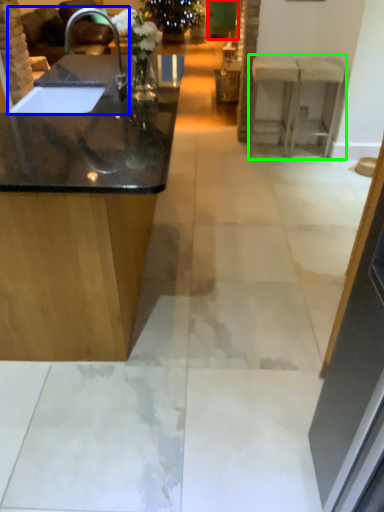
Question: Considering the real-world distances, which object is closest to glass door (highlighted by a red box)? sink (highlighted by a blue box) or counter (highlighted by a green box).

Choices:
 (A) sink
 (B) counter

Answer: (A)